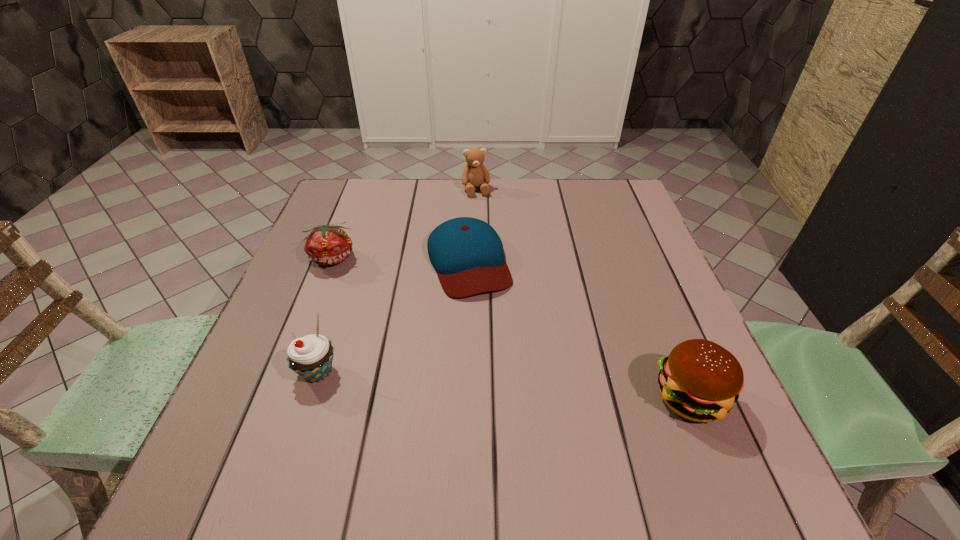
Find the location of `free space that is in between the tomato and the baseball cap`. free space that is in between the tomato and the baseball cap is located at coordinates (400, 260).

Image resolution: width=960 pixels, height=540 pixels. Identify the location of unoccupied position between the rightmost object and the farthest object. (583, 293).

Locate an element on the screen. The width and height of the screenshot is (960, 540). vacant area that lies between the teddy bear and the tomato is located at coordinates (404, 224).

At what (x,y) coordinates should I click in order to perform the action: click on free space between the baseball cap and the tomato. Please return your answer as a coordinate pair (x, y). Looking at the image, I should click on (400, 260).

Identify the location of free point between the cupcake and the teddy bear. (396, 281).

At what (x,y) coordinates should I click in order to perform the action: click on vacant space in between the cupcake and the tomato. Please return your answer as a coordinate pair (x, y). The width and height of the screenshot is (960, 540). Looking at the image, I should click on (324, 315).

Choose which object is the second nearest neighbor to the tomato. Please provide its 2D coordinates. Your answer should be formatted as a tuple, i.e. [(x, y)], where the tuple contains the x and y coordinates of a point satisfying the conditions above.

[(311, 356)]

Choose which object is the nearest neighbor to the baseball cap. Please provide its 2D coordinates. Your answer should be formatted as a tuple, i.e. [(x, y)], where the tuple contains the x and y coordinates of a point satisfying the conditions above.

[(475, 174)]

This screenshot has width=960, height=540. Identify the location of free space that satisfies the following two spatial constraints: 1. on the front side of the farthest object; 2. on the right side of the hamburger. (x=473, y=396).